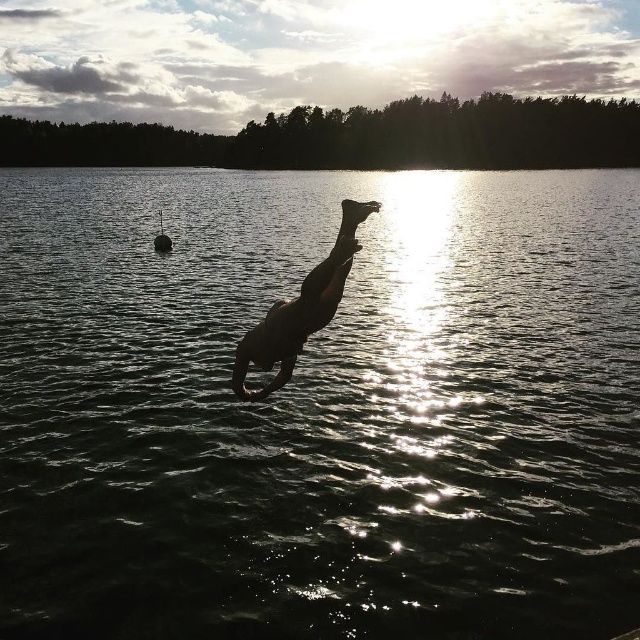
You are standing on a dock and want to jump into the dark water at center. The safety rule states that you must be at least 5 meters away from the water to dive safely. Are you within the safe diving distance?

The dark water at center is 6.85 meters away from the viewer. Since the safety rule requires being at least 5 meters away, you are within the safe diving distance as 6.85 meters exceeds the minimum requirement.

From the picture: You are a photographer trying to capture the sunset reflection on the water. You notice the dark water at center and the black matte person at center in your frame. Which object is higher in the image?

The dark water at center is taller than the black matte person at center, so the dark water at center is higher in the image.